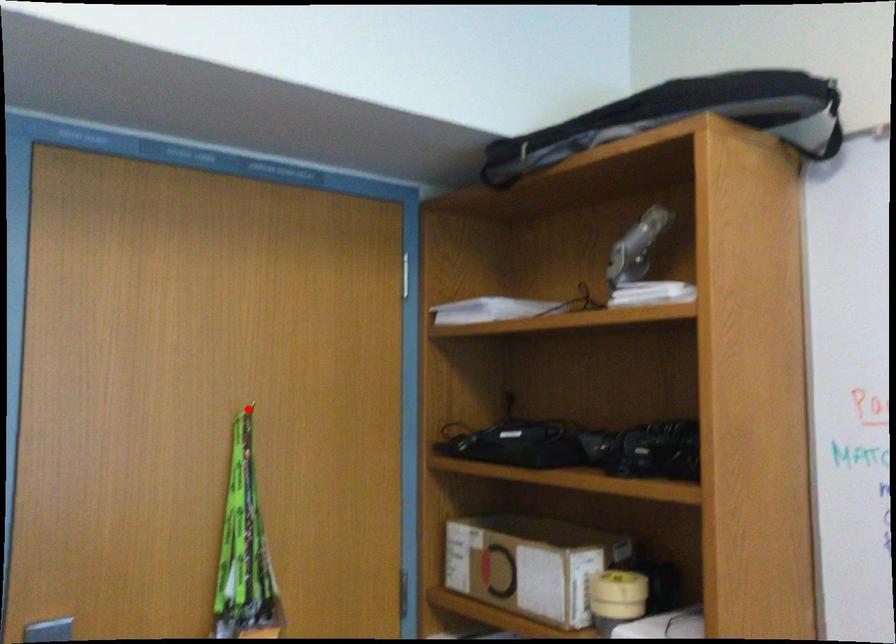
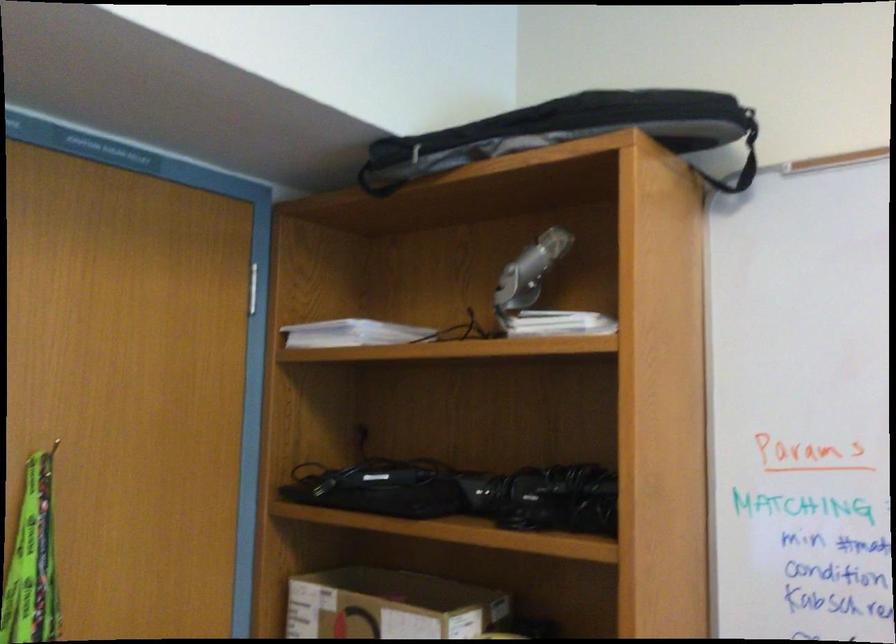
Find the pixel in the second image that matches the highlighted location in the first image.

(53, 448)